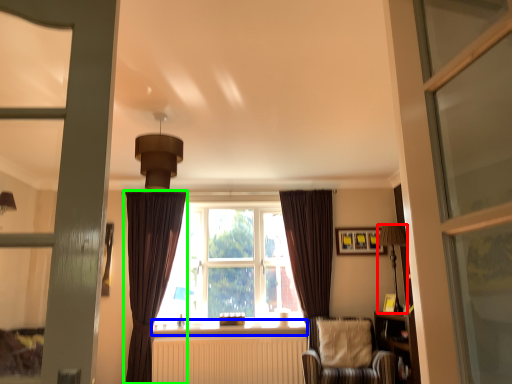
Question: Which object is positioned closest to light fixture (highlighted by a red box)? Select from window sill (highlighted by a blue box) and curtain (highlighted by a green box).

Choices:
 (A) window sill
 (B) curtain

Answer: (A)